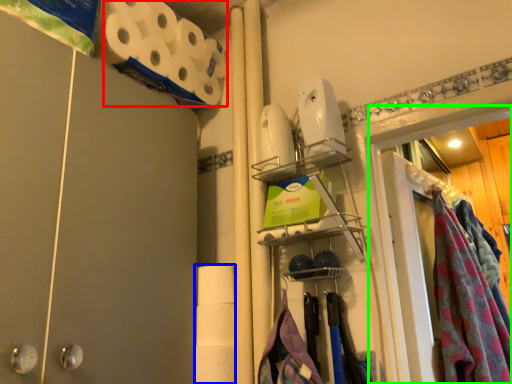
Question: Based on their relative distances, which object is nearer to toilet paper (highlighted by a red box)? Choose from toilet paper (highlighted by a blue box) and glass door (highlighted by a green box).

Choices:
 (A) toilet paper
 (B) glass door

Answer: (A)